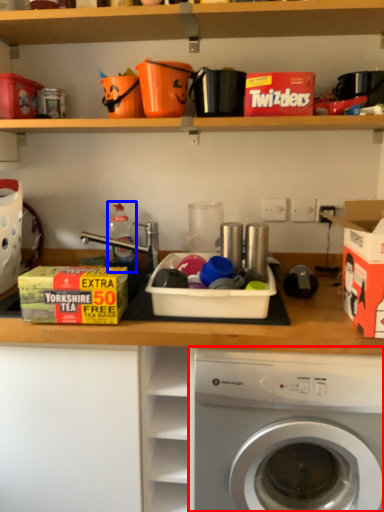
Question: Which object appears farthest to the camera in this image, washing machine (highlighted by a red box) or bottle (highlighted by a blue box)?

Choices:
 (A) washing machine
 (B) bottle

Answer: (B)